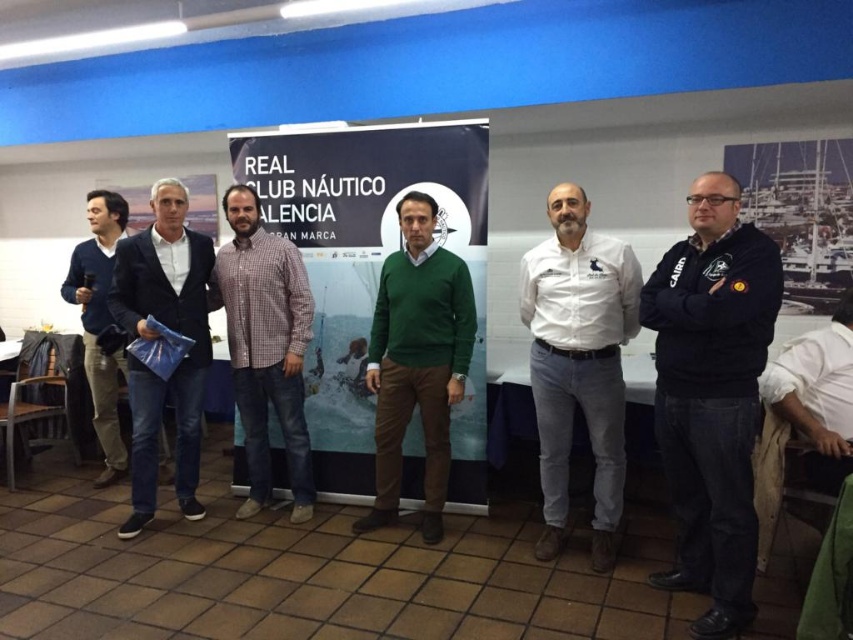
You are standing in front of the banner at Real Club Nautico Valencia and see the point marked at coordinates (712, 396). Which object from the scene does this point belong to?

The point at coordinates (712, 396) is on the black fleece jacket at center.

You are standing in the room where the banner is displayed. You see two points marked on the wall. The first point is at coordinates point (386, 278) and the second is at point (125, 362). If you want to touch the closest point to you on the wall, which coordinate should you aim for?

Point (386, 278) is closer to the viewer than point (125, 362), so you should aim for point (386, 278).